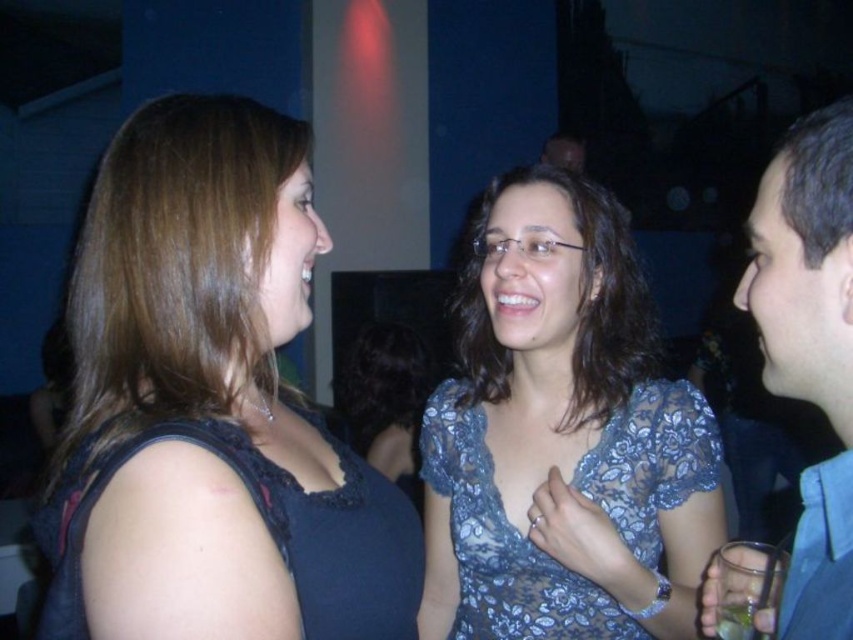
Between dark blue lace dress at left and green glass at lower right, which one is positioned lower?

green glass at lower right

Can you confirm if dark blue lace dress at left is positioned to the left of green glass at lower right?

Indeed, dark blue lace dress at left is positioned on the left side of green glass at lower right.

The width and height of the screenshot is (853, 640). What are the coordinates of `dark blue lace dress at left` in the screenshot? It's located at (268, 531).

Locate an element on the screen. The height and width of the screenshot is (640, 853). dark blue lace dress at left is located at coordinates pos(268,531).

In the scene shown: Can you confirm if matte black top at left is positioned above lacy blue dress at center?

Yes, matte black top at left is above lacy blue dress at center.

Is matte black top at left bigger than lacy blue dress at center?

No.

Measure the distance between point (125, 180) and camera.

A distance of 74.91 centimeters exists between point (125, 180) and camera.

Identify the location of matte black top at left. (209, 406).

In the scene shown: Can you confirm if lacy blue dress at center is positioned to the right of green glass at lower right?

Incorrect, lacy blue dress at center is not on the right side of green glass at lower right.

Is point (590, 538) positioned behind point (762, 604)?

Yes, point (590, 538) is behind point (762, 604).

Locate an element on the screen. Image resolution: width=853 pixels, height=640 pixels. lacy blue dress at center is located at coordinates (561, 436).